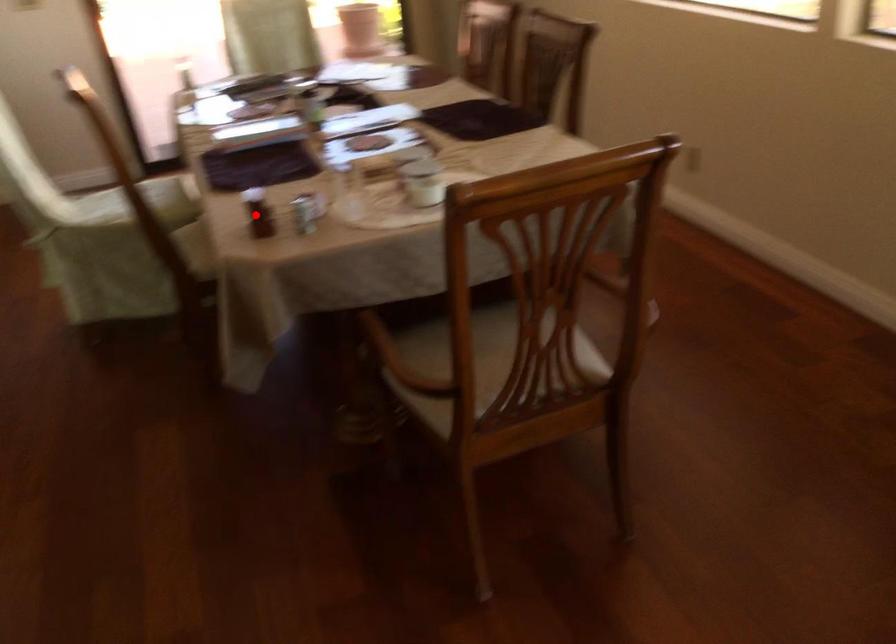
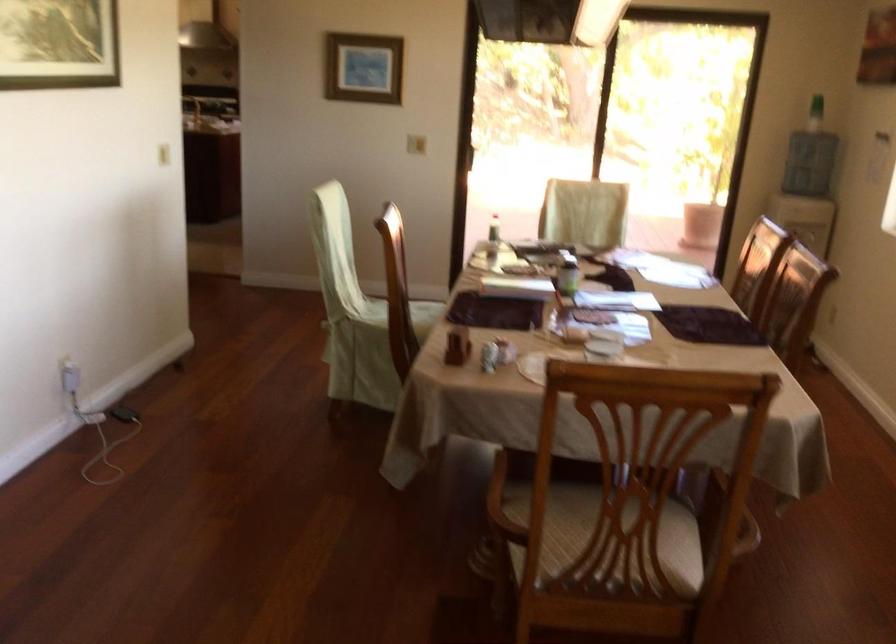
In the second image, find the point that corresponds to the highlighted location in the first image.

(458, 345)